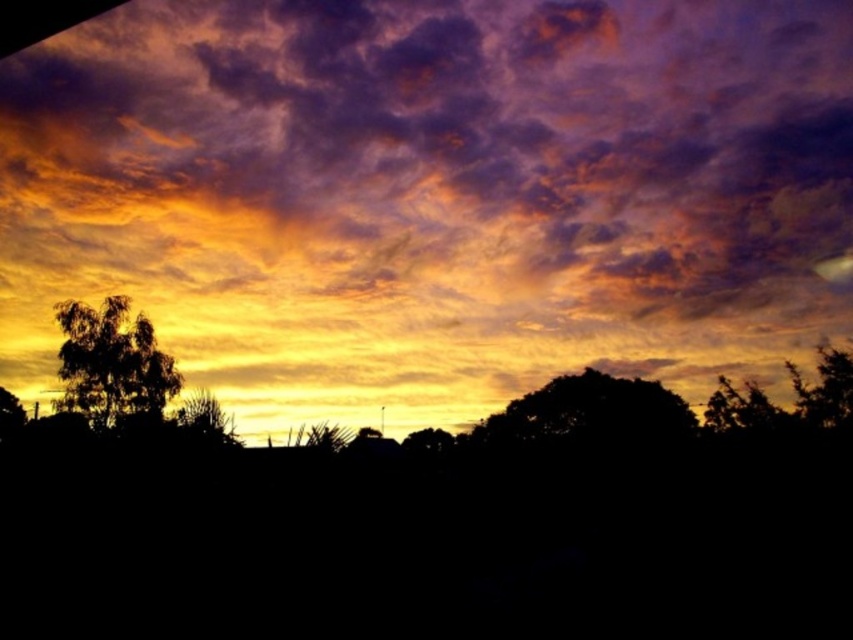
Looking at this image, you are an artist painting the sunset scene and want to ensure the silhouette leafy tree at lower left and the green leafy tree at lower left are proportionally accurate. Which tree should you paint smaller to maintain the correct size relationship?

You should paint the silhouette leafy tree at lower left smaller than the green leafy tree at lower left because the silhouette leafy tree at lower left occupies less space than the green leafy tree at lower left.